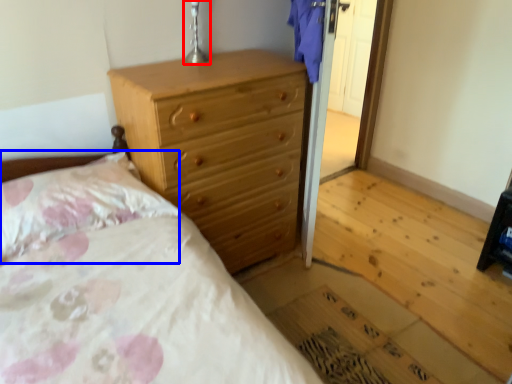
Question: Among these objects, which one is farthest to the camera, table lamp (highlighted by a red box) or pillow (highlighted by a blue box)?

Choices:
 (A) table lamp
 (B) pillow

Answer: (A)